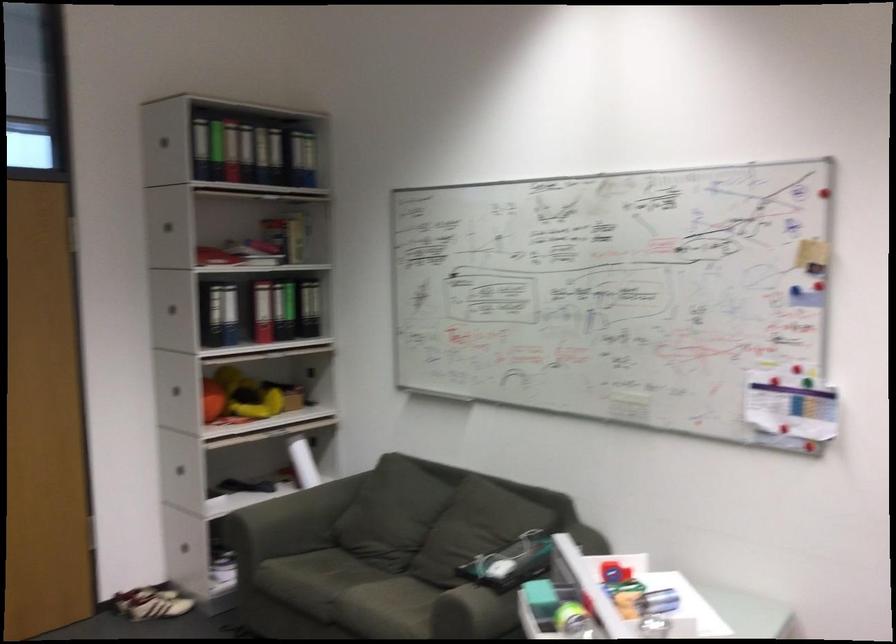
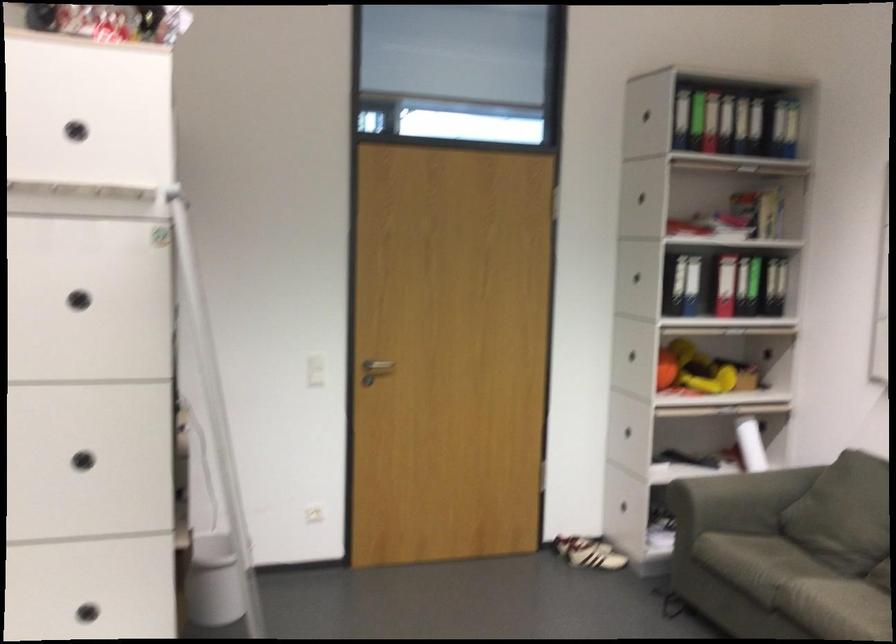
In the second image, find the point that corresponds to point (338, 569) in the first image.

(787, 550)